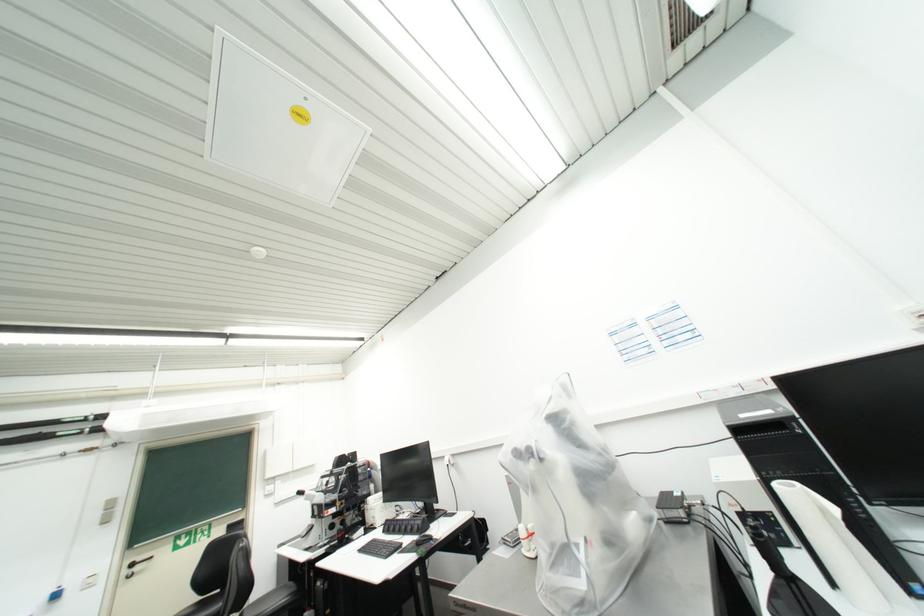
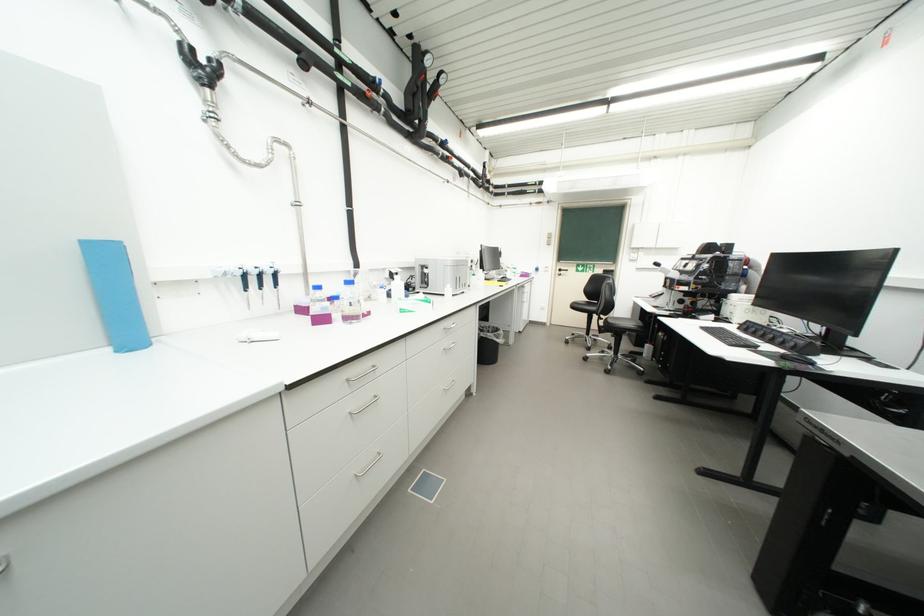
Where in the second image is the point corresponding to (426,546) from the first image?

(792, 359)